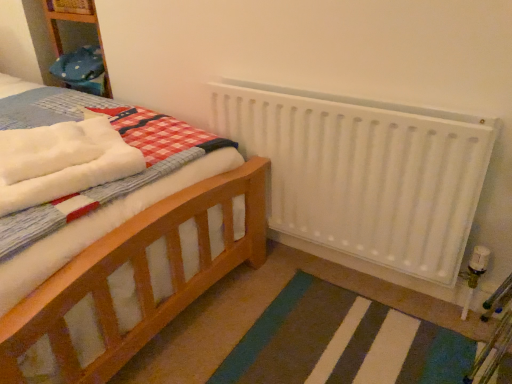
This screenshot has width=512, height=384. Find the location of `blank space situated above white fluffy bath towel at left (from a real-world perspective)`. blank space situated above white fluffy bath towel at left (from a real-world perspective) is located at coordinates (48, 150).